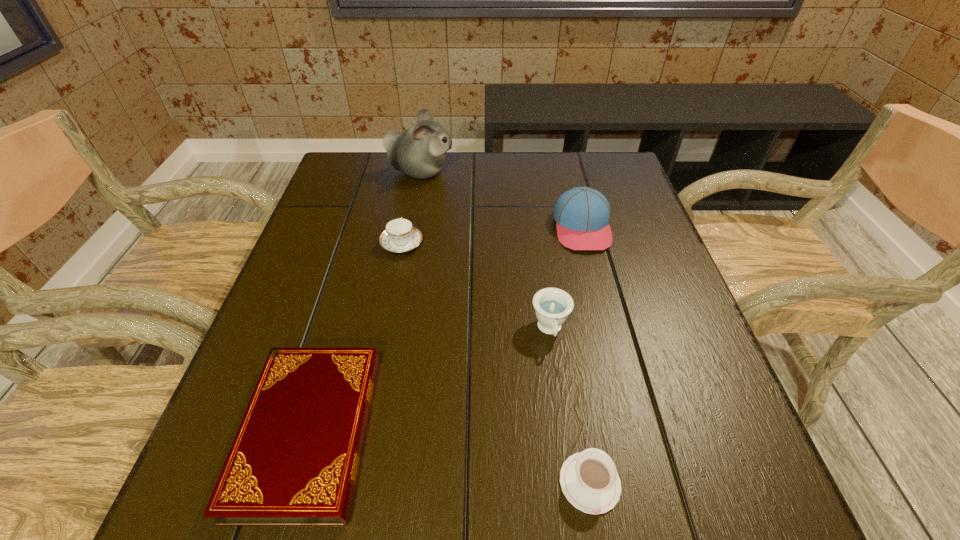
Select which object appears as the closest to the nearest teacup. Please provide its 2D coordinates. Your answer should be formatted as a tuple, i.e. [(x, y)], where the tuple contains the x and y coordinates of a point satisfying the conditions above.

[(552, 306)]

I want to click on object that can be found as the third closest to the second nearest teacup, so click(400, 235).

Locate an element on the screen. The width and height of the screenshot is (960, 540). teacup identified as the second closest to the nearest teacup is located at coordinates (400, 235).

The height and width of the screenshot is (540, 960). What are the coordinates of `teacup that is the second closest one to the tallest teacup` in the screenshot? It's located at tap(400, 235).

Where is `free space that satisfies the following two spatial constraints: 1. on the face of the tallest object; 2. on the cover of the hardback book`? free space that satisfies the following two spatial constraints: 1. on the face of the tallest object; 2. on the cover of the hardback book is located at coordinates (375, 431).